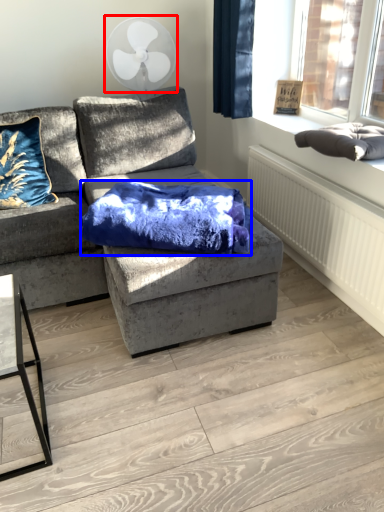
Question: Among these objects, which one is nearest to the camera, mechanical fan (highlighted by a red box) or blanket (highlighted by a blue box)?

Choices:
 (A) mechanical fan
 (B) blanket

Answer: (B)